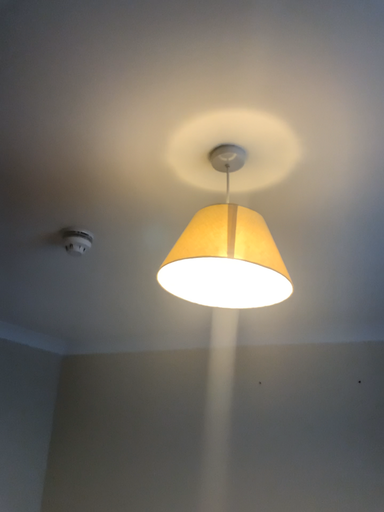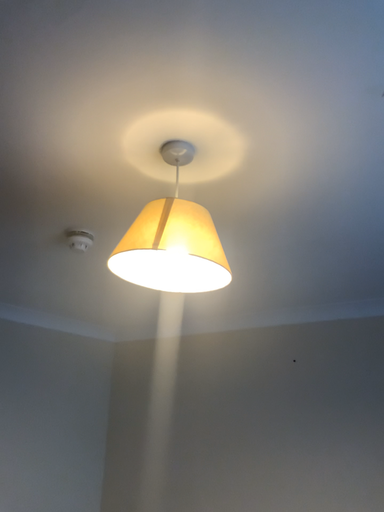
Question: How did the camera likely rotate when shooting the video?

Choices:
 (A) rotated left
 (B) rotated right

Answer: (A)